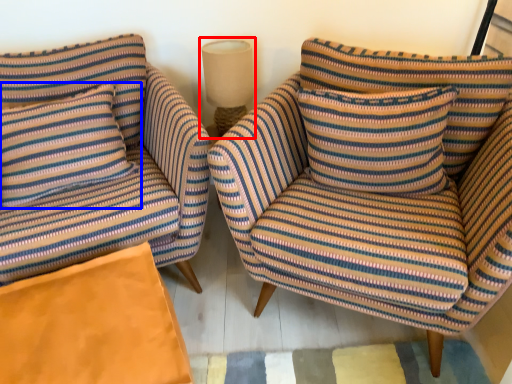
Question: Which point is closer to the camera, lamp (highlighted by a red box) or pillow (highlighted by a blue box)?

Choices:
 (A) lamp
 (B) pillow

Answer: (B)